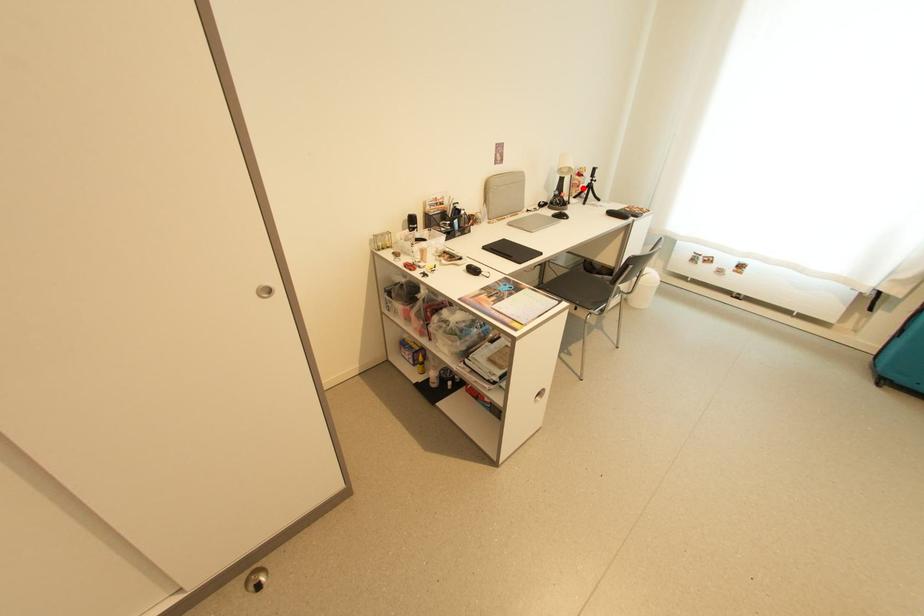
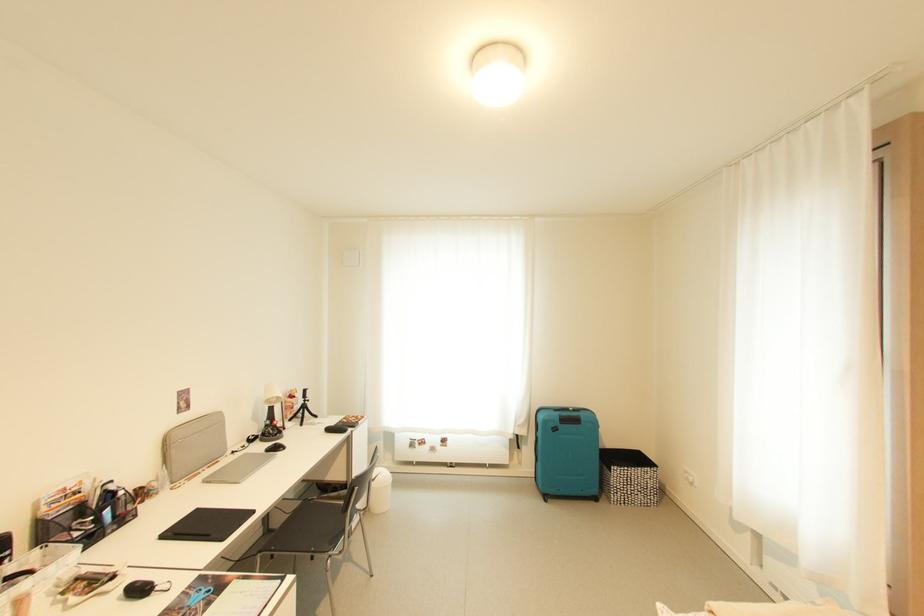
The point at the highlighted location is marked in the first image. Where is the corresponding point in the second image?

(297, 410)